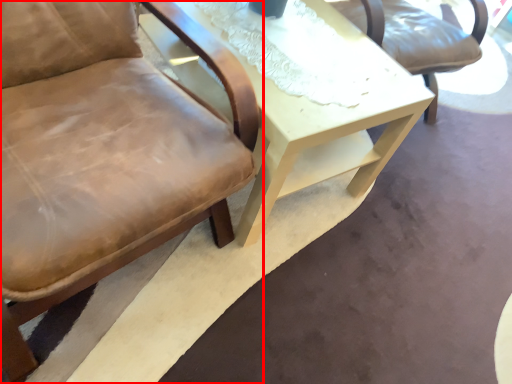
Question: Considering the relative positions of chair (annotated by the red box) and table in the image provided, where is chair (annotated by the red box) located with respect to the staircase?

Choices:
 (A) right
 (B) left

Answer: (B)